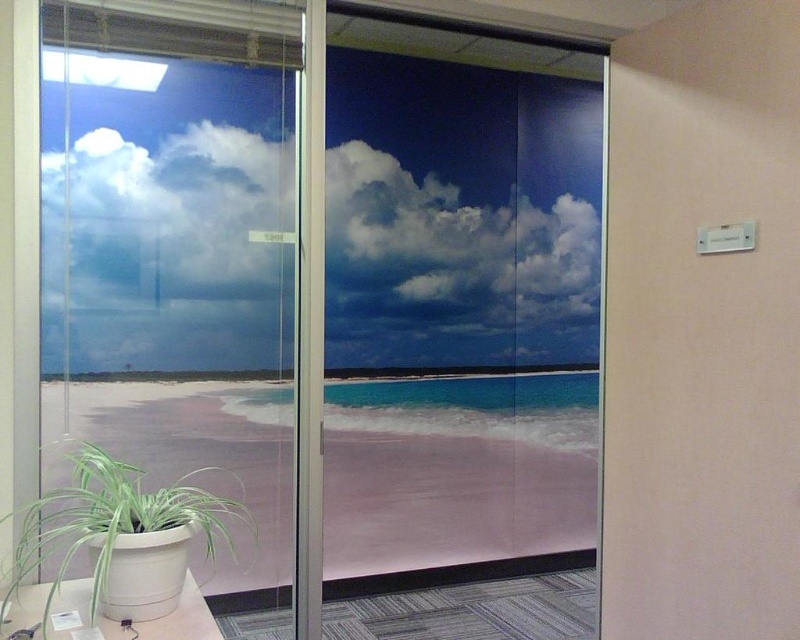
Can you confirm if transparent glass door at center is wider than transparent glass door at left?

Indeed, transparent glass door at center has a greater width compared to transparent glass door at left.

Is transparent glass door at center positioned at the back of transparent glass door at left?

That is True.

You are a GUI agent. You are given a task and a screenshot of the screen. Output one action in this format:
    pyautogui.click(x=<x>, y=<y>)
    Task: Click on the transparent glass door at center
    
    Given the screenshot: What is the action you would take?
    pyautogui.click(x=326, y=298)

Which is more to the right, white fluffy cloud at upper center or green leafy plant at lower left?

From the viewer's perspective, white fluffy cloud at upper center appears more on the right side.

Which is behind, point (256, 260) or point (24, 573)?

Positioned behind is point (256, 260).

Image resolution: width=800 pixels, height=640 pixels. What are the coordinates of `white fluffy cloud at upper center` in the screenshot? It's located at [x=462, y=243].

Between transparent glass door at center and white fluffy cloud at upper center, which one has more height?

transparent glass door at center

Is transparent glass door at center to the left of white fluffy cloud at upper center from the viewer's perspective?

In fact, transparent glass door at center is to the right of white fluffy cloud at upper center.

Locate an element on the screen. The image size is (800, 640). transparent glass door at center is located at coordinates (326, 298).

Locate an element on the screen. This screenshot has width=800, height=640. transparent glass door at center is located at coordinates (326, 298).